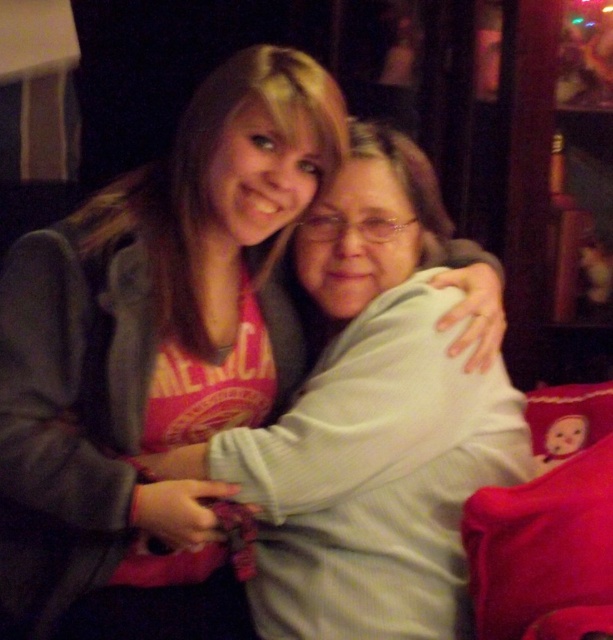
Question: Is red plush pillow at lower right further to camera compared to velvet plush pillow at upper right?

Choices:
 (A) no
 (B) yes

Answer: (A)

Question: Which point is closer to the camera taking this photo?

Choices:
 (A) (560, 554)
 (B) (573, 394)

Answer: (A)

Question: Is red plush pillow at lower right wider than velvet plush pillow at upper right?

Choices:
 (A) no
 (B) yes

Answer: (B)

Question: Which of the following is the closest to the observer?

Choices:
 (A) (563, 448)
 (B) (600, 442)

Answer: (B)

Question: Is the position of red plush pillow at lower right less distant than that of velvet plush pillow at upper right?

Choices:
 (A) no
 (B) yes

Answer: (B)